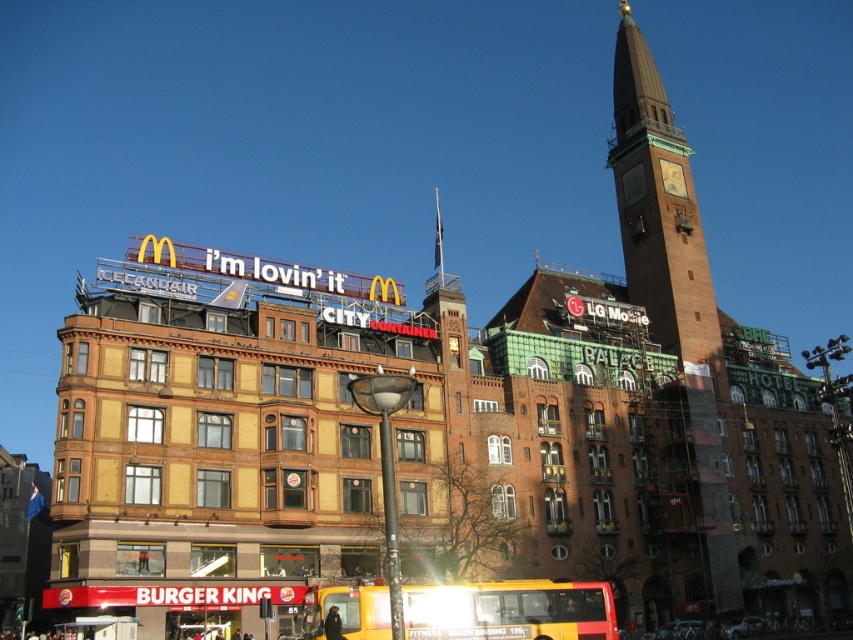
Can you confirm if brown brick clock tower at center is positioned above yellow matte bus at lower center?

Correct, brown brick clock tower at center is located above yellow matte bus at lower center.

Does point (624, 3) come farther from viewer compared to point (311, 589)?

Yes.

What do you see at coordinates (672, 280) in the screenshot?
I see `brown brick clock tower at center` at bounding box center [672, 280].

Locate an element on the screen. brown brick clock tower at center is located at coordinates (672, 280).